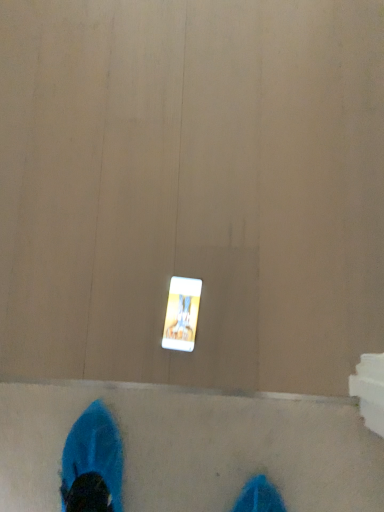
What do you see at coordinates (182, 314) in the screenshot? I see `white glossy mobile phone at center` at bounding box center [182, 314].

What is the approximate width of white glossy mobile phone at center?

It is 6.41 inches.

You are a GUI agent. You are given a task and a screenshot of the screen. Output one action in this format:
    pyautogui.click(x=<x>, y=<y>)
    Task: Click on the white glossy mobile phone at center
    Image resolution: width=384 pixels, height=512 pixels.
    Given the screenshot: What is the action you would take?
    pyautogui.click(x=182, y=314)

In order to face white glossy mobile phone at center, should I rotate leftwards or rightwards?

Rotate left and turn 1.421 degrees.

Locate an element on the screen. This screenshot has height=512, width=384. white glossy mobile phone at center is located at coordinates (182, 314).